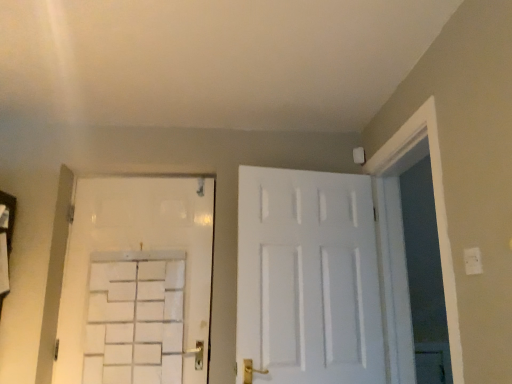
Question: Considering the relative sizes of white matte door at upper left, positioned as the first door in left-to-right order, and white matte door at center, positioned as the 1th door in right-to-left order, in the image provided, is white matte door at upper left, positioned as the first door in left-to-right order, shorter than white matte door at center, positioned as the 1th door in right-to-left order,?

Choices:
 (A) yes
 (B) no

Answer: (B)

Question: Is white matte door at upper left, positioned as the first door in left-to-right order, outside of white matte door at center, positioned as the 1th door in right-to-left order?

Choices:
 (A) yes
 (B) no

Answer: (A)

Question: From the image's perspective, would you say white matte door at upper left, which is counted as the 2th door, starting from the right, is positioned over white matte door at center, positioned as the 1th door in right-to-left order?

Choices:
 (A) yes
 (B) no

Answer: (B)

Question: Does white matte door at upper left, positioned as the first door in left-to-right order, have a greater height compared to white matte door at center, which is the 2th door from left to right?

Choices:
 (A) yes
 (B) no

Answer: (A)

Question: Does white matte door at upper left, positioned as the first door in left-to-right order, have a greater width compared to white matte door at center, which is the 2th door from left to right?

Choices:
 (A) yes
 (B) no

Answer: (B)

Question: Is white plastic electric outlet at upper right bigger or smaller than white matte door at center, positioned as the 1th door in right-to-left order?

Choices:
 (A) big
 (B) small

Answer: (B)

Question: In the image, is white plastic electric outlet at upper right on the left side or the right side of white matte door at center, which is the 2th door from left to right?

Choices:
 (A) right
 (B) left

Answer: (A)

Question: From a real-world perspective, relative to white matte door at center, which is the 2th door from left to right, is white plastic electric outlet at upper right vertically above or below?

Choices:
 (A) below
 (B) above

Answer: (A)

Question: Does point (478, 264) appear closer or farther from the camera than point (279, 367)?

Choices:
 (A) farther
 (B) closer

Answer: (B)

Question: From a real-world perspective, is white matte door at center, positioned as the 1th door in right-to-left order, physically located above or below white plastic electric outlet at upper right?

Choices:
 (A) below
 (B) above

Answer: (B)

Question: From the image's perspective, relative to white plastic electric outlet at upper right, is white matte door at center, positioned as the 1th door in right-to-left order, above or below?

Choices:
 (A) above
 (B) below

Answer: (B)

Question: In terms of height, does white matte door at center, which is the 2th door from left to right, look taller or shorter compared to white plastic electric outlet at upper right?

Choices:
 (A) tall
 (B) short

Answer: (A)

Question: Considering the positions of white matte door at center, which is the 2th door from left to right, and white plastic electric outlet at upper right in the image, is white matte door at center, which is the 2th door from left to right, bigger or smaller than white plastic electric outlet at upper right?

Choices:
 (A) small
 (B) big

Answer: (B)

Question: Choose the correct answer: Is white plastic electric outlet at upper right inside white matte door at upper left, positioned as the first door in left-to-right order, or outside it?

Choices:
 (A) inside
 (B) outside

Answer: (B)

Question: Is white plastic electric outlet at upper right in front of or behind white matte door at upper left, which is counted as the 2th door, starting from the right, in the image?

Choices:
 (A) behind
 (B) front

Answer: (B)